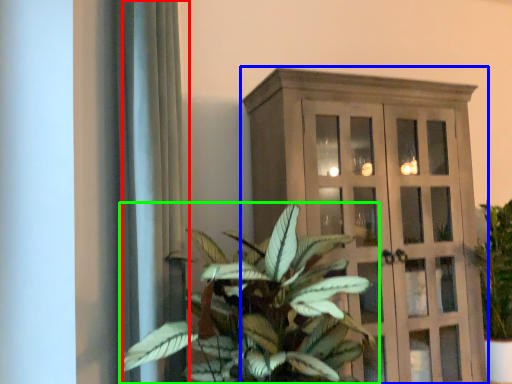
Question: Which is farther away from curtain (highlighted by a red box)? cupboard (highlighted by a blue box) or houseplant (highlighted by a green box)?

Choices:
 (A) cupboard
 (B) houseplant

Answer: (A)